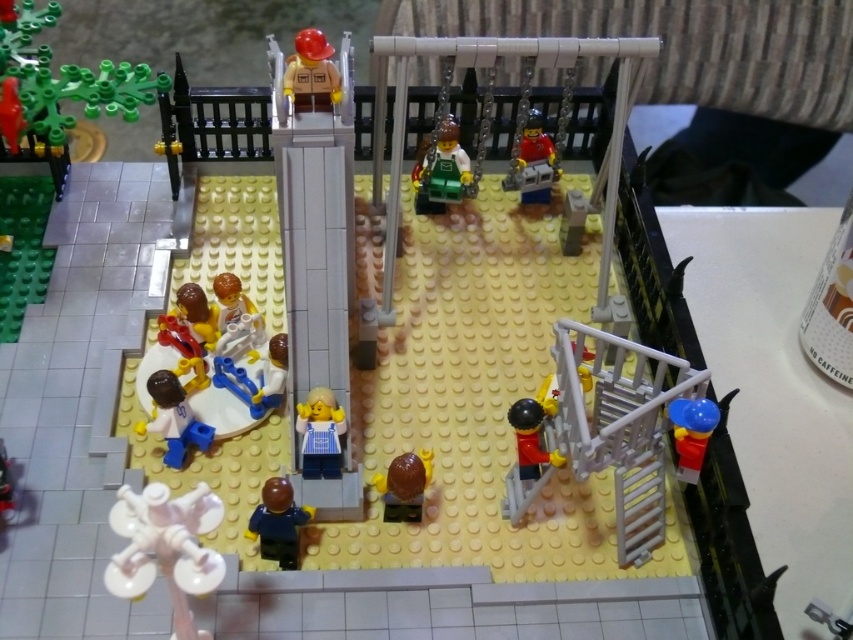
Question: Can you confirm if matte brown vest at upper center is positioned below brown matte minifigure at center-left?

Choices:
 (A) yes
 (B) no

Answer: (B)

Question: Where is white matte figure at lower left located in relation to smooth plastic toy at lower left in the image?

Choices:
 (A) below
 (B) above

Answer: (B)

Question: Which is farther from the blue plastic minifigure at center?

Choices:
 (A) blue plastic toy at center-left
 (B) light brown plastic minifigure at center
 (C) shiny red helmet at lower right

Answer: (C)

Question: Which point appears closest to the camera in this image?

Choices:
 (A) (239, 284)
 (B) (409, 499)

Answer: (B)

Question: Estimate the real-world distances between objects in this image. Which object is closer to the brown matte minifigure at center-left?

Choices:
 (A) white plastic minifigures at center
 (B) blue plastic toy at center-left
 (C) white plastic windmill at lower left
 (D) blue plastic minifigure at center

Answer: (A)

Question: Can you confirm if brown matte minifigure at lower center is positioned above matte brown vest at upper center?

Choices:
 (A) yes
 (B) no

Answer: (B)